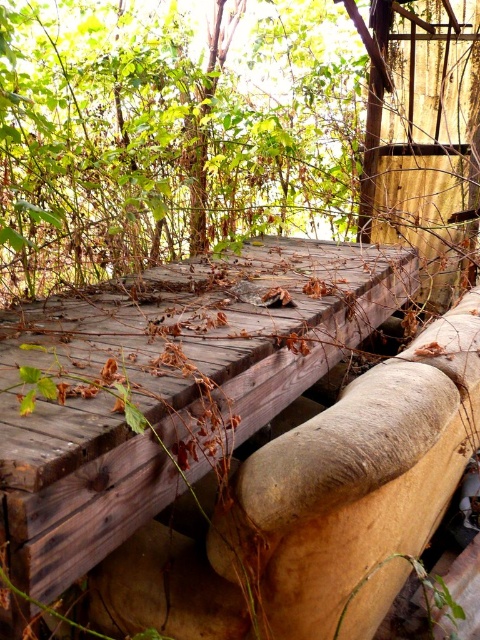
Who is positioned more to the right, green leafy tree at upper center or weathered wood bench at center?

From the viewer's perspective, weathered wood bench at center appears more on the right side.

Image resolution: width=480 pixels, height=640 pixels. Describe the element at coordinates (167, 138) in the screenshot. I see `green leafy tree at upper center` at that location.

Find the location of a particular element. green leafy tree at upper center is located at coordinates (167, 138).

Locate an element on the screen. The width and height of the screenshot is (480, 640). green leafy tree at upper center is located at coordinates (167, 138).